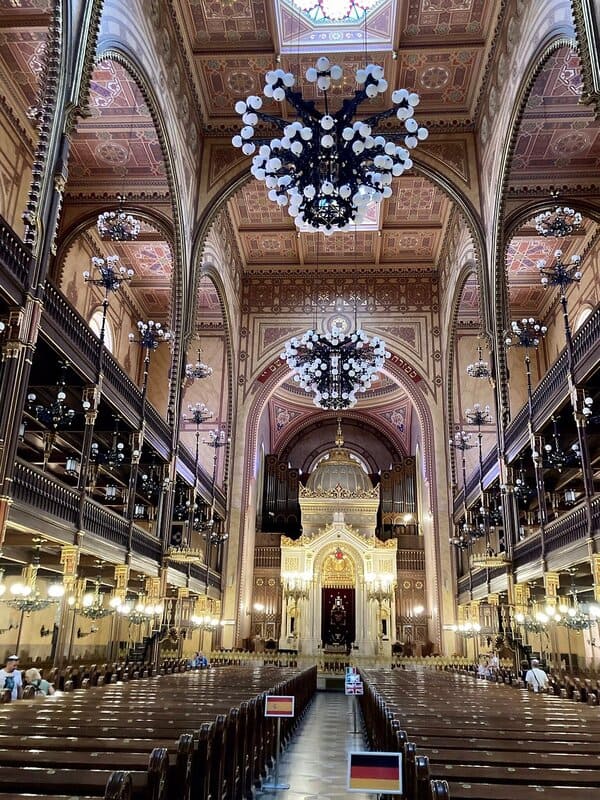
Locate an element on the screen. The height and width of the screenshot is (800, 600). floor is located at coordinates (323, 750).